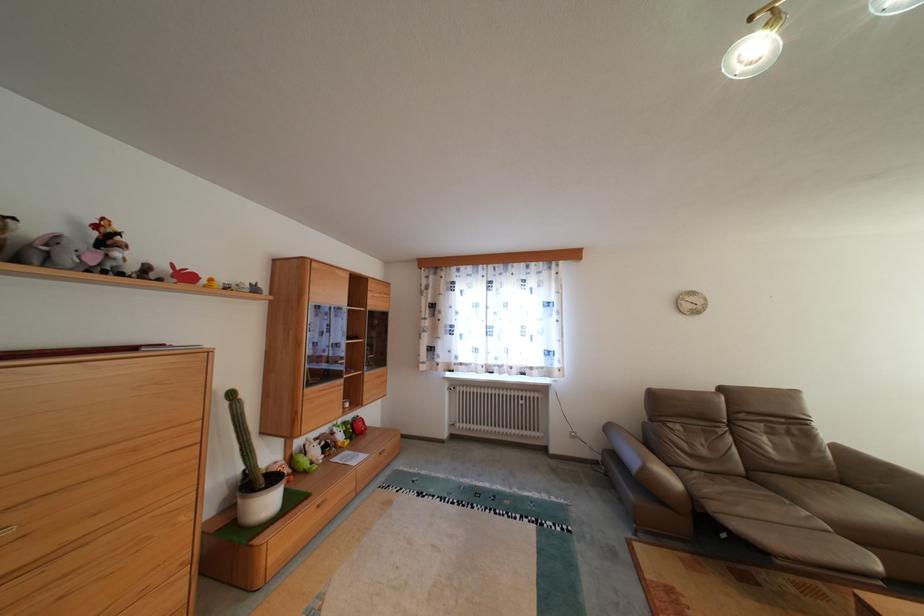
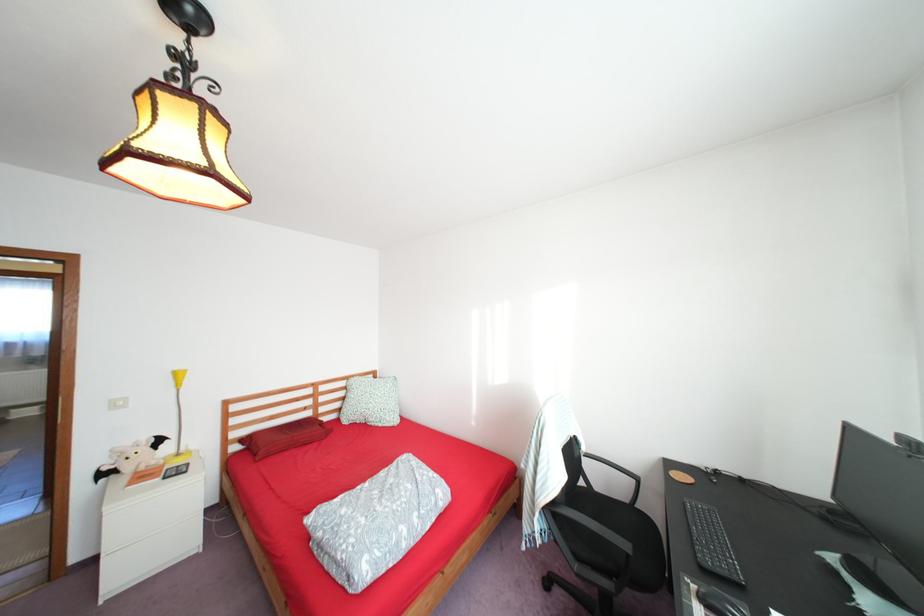
Question: I am providing you with two images of the same scene from different viewpoints. Which of the following objects are not visible in image2?

Choices:
 (A) black chair armrest
 (B) colorful round container
 (C) brown sofa armrest
 (D) black computer mouse

Answer: (C)